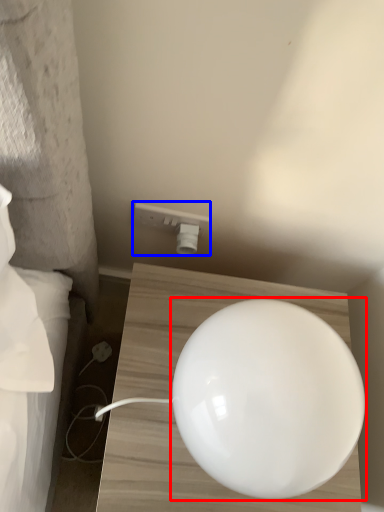
Question: Which object is closer to the camera taking this photo, lamp (highlighted by a red box) or electric outlet (highlighted by a blue box)?

Choices:
 (A) lamp
 (B) electric outlet

Answer: (A)